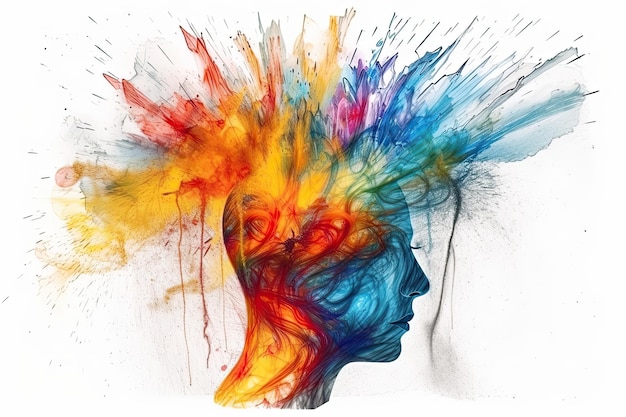
Where is `blue paint`? blue paint is located at coordinates (393, 301), (436, 119), (514, 131), (424, 64), (371, 70), (297, 82).